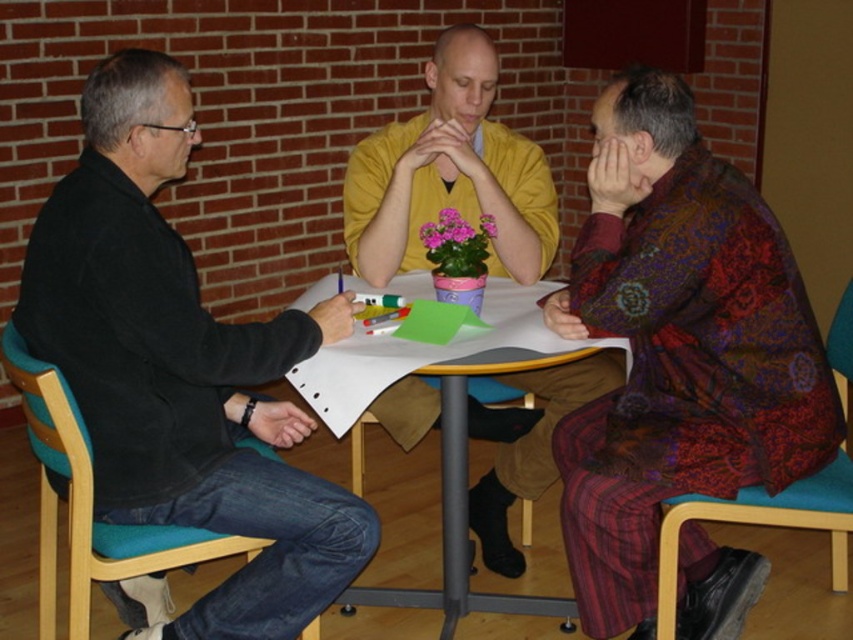
Measure the distance between patterned silk shirt at right and teal wood chair at lower left.

They are 3.50 feet apart.

Which is above, patterned silk shirt at right or teal wood chair at lower left?

patterned silk shirt at right is higher up.

Which is behind, point (701, 312) or point (82, 547)?

Positioned behind is point (701, 312).

You are a GUI agent. You are given a task and a screenshot of the screen. Output one action in this format:
    pyautogui.click(x=<x>, y=<y>)
    Task: Click on the patterned silk shirt at right
    Image resolution: width=853 pixels, height=640 pixels.
    Given the screenshot: What is the action you would take?
    pyautogui.click(x=677, y=348)

Does teal wood chair at lower left have a greater width compared to blue fabric chair at lower right?

Yes.

Is point (48, 604) farther from viewer compared to point (843, 300)?

That is False.

This screenshot has width=853, height=640. Identify the location of teal wood chair at lower left. (90, 502).

Looking at this image, which of these two, black matte jacket at left or blue fabric chair at lower right, stands shorter?

Standing shorter between the two is blue fabric chair at lower right.

Who is higher up, black matte jacket at left or blue fabric chair at lower right?

Positioned higher is black matte jacket at left.

This screenshot has height=640, width=853. Describe the element at coordinates (180, 372) in the screenshot. I see `black matte jacket at left` at that location.

You are a GUI agent. You are given a task and a screenshot of the screen. Output one action in this format:
    pyautogui.click(x=<x>, y=<y>)
    Task: Click on the black matte jacket at left
    
    Given the screenshot: What is the action you would take?
    pyautogui.click(x=180, y=372)